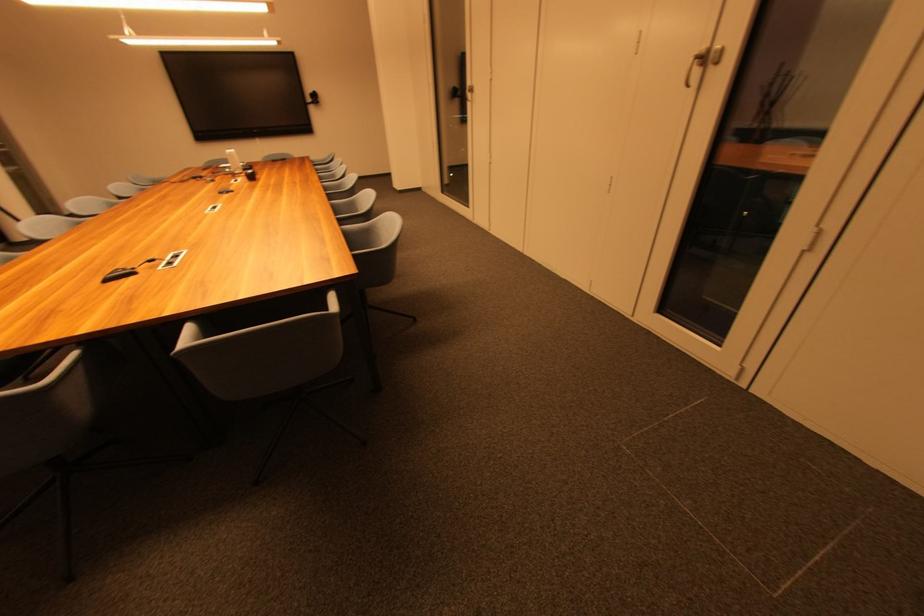
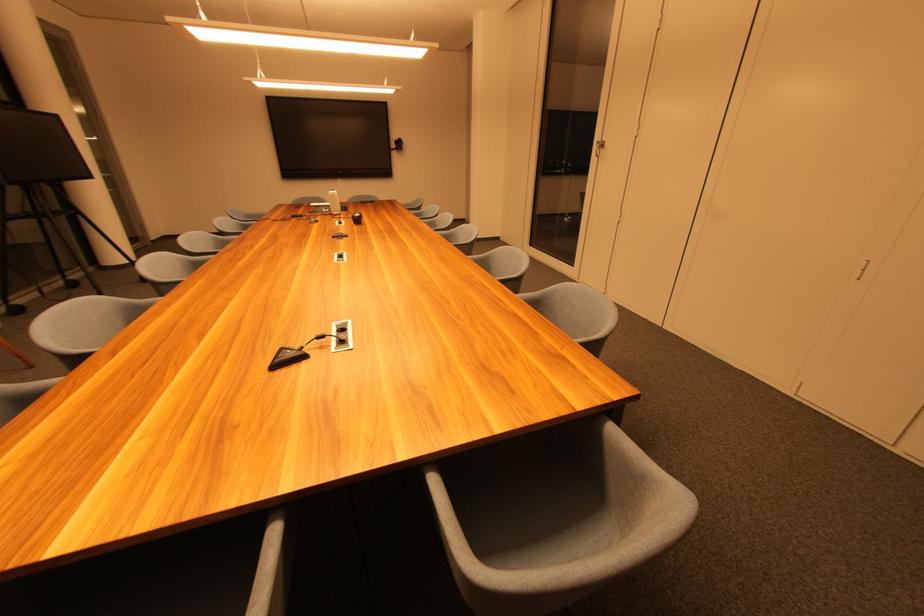
Where in the second image is the point corresponding to the point at 236,155 from the first image?

(337, 196)